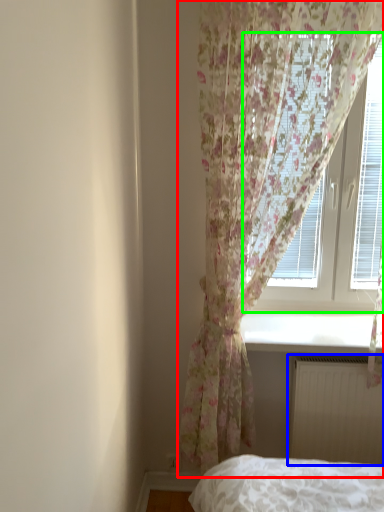
Question: Based on their relative distances, which object is farther from curtain (highlighted by a red box)? Choose from radiator (highlighted by a blue box) and window (highlighted by a green box).

Choices:
 (A) radiator
 (B) window

Answer: (A)